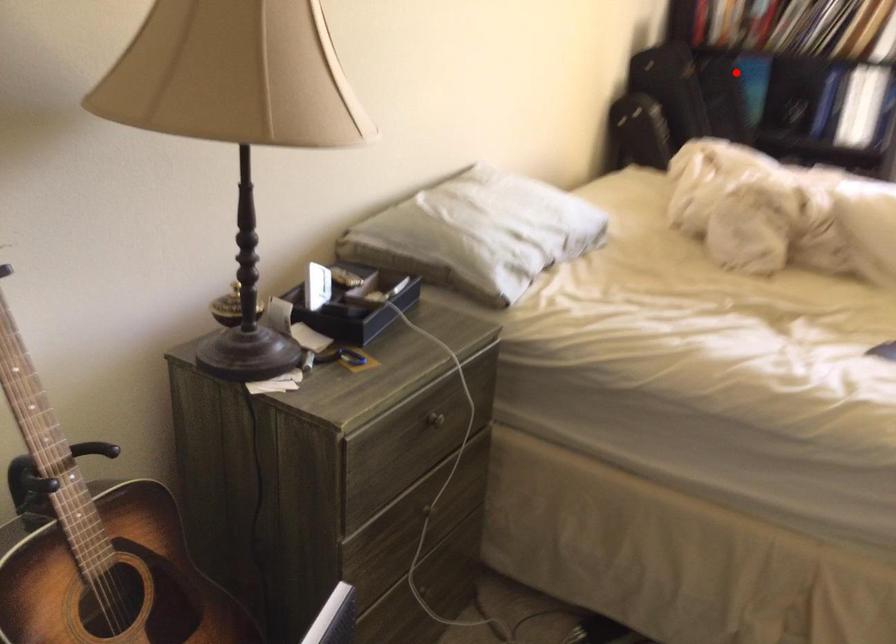
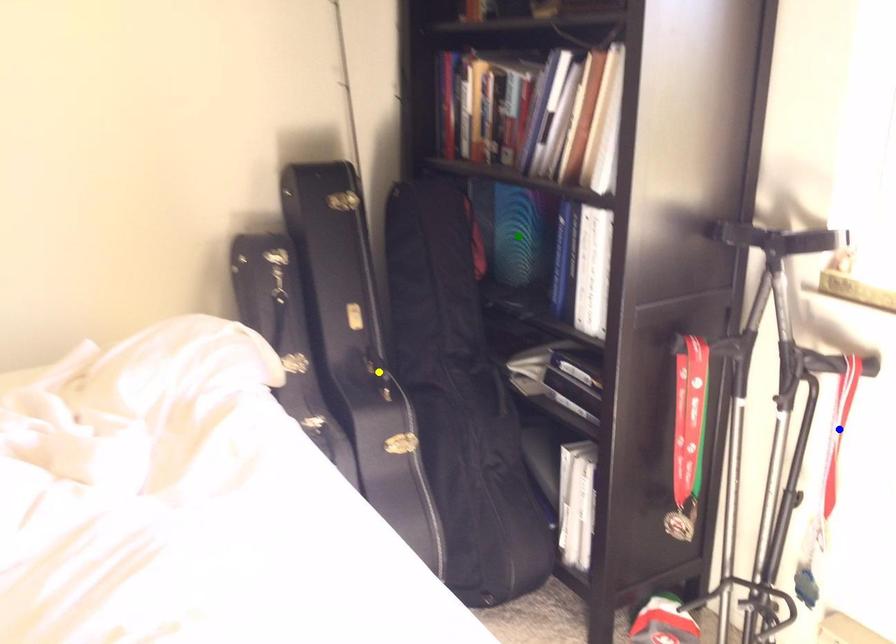
Question: I am providing you with two images of the same scene from different viewpoints. A red point is marked on the first image. You are given multiple points on the second image. Which spot in image 2 lines up with the point in image 1?

Choices:
 (A) green point
 (B) blue point
 (C) yellow point

Answer: (A)